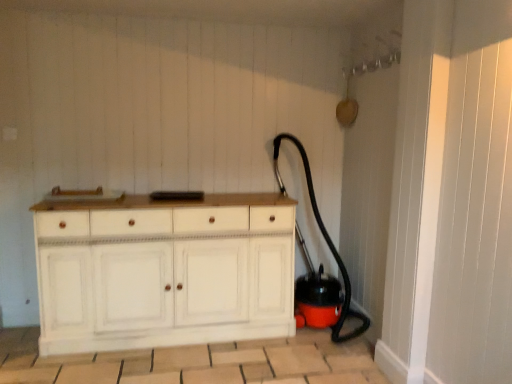
Locate an element on the screen. The image size is (512, 384). free region under black rubber garden hose at lower right (from a real-world perspective) is located at coordinates (315, 337).